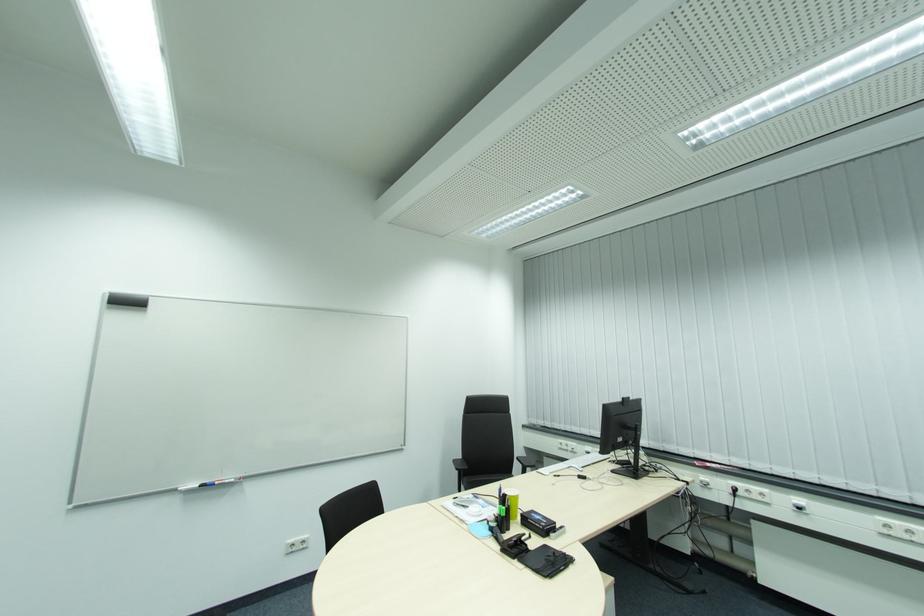
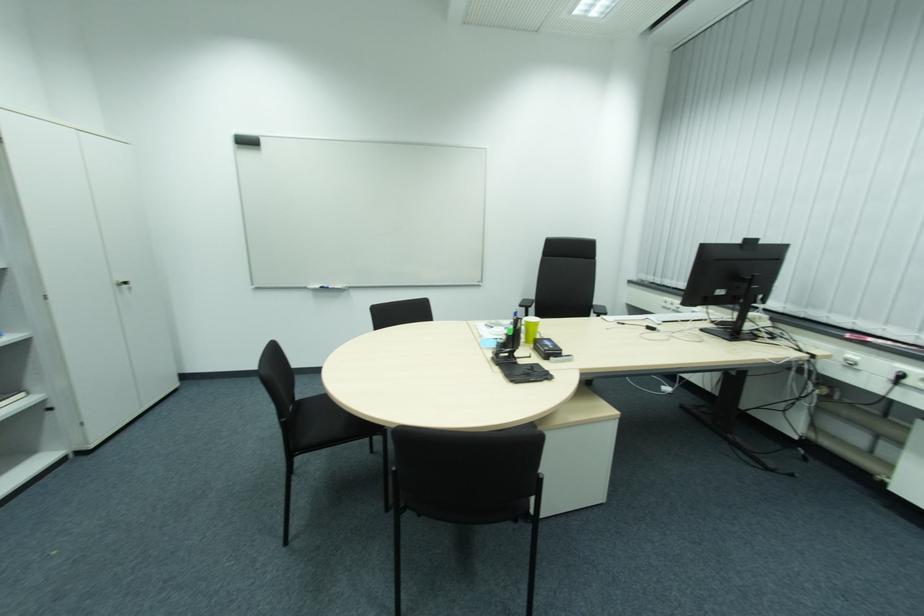
The first image is from the beginning of the video and the second image is from the end. How did the camera likely rotate when shooting the video?

The camera's rotation is toward left-down.